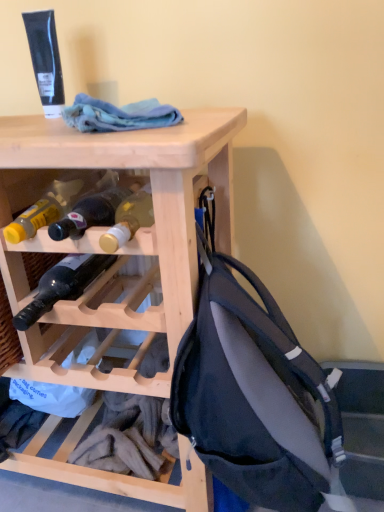
Question: Which direction should I rotate to look at matte glass bottle at center, acting as the second bottle starting from the bottom, — up or down?

Choices:
 (A) down
 (B) up

Answer: (B)

Question: Does matte black backpack at right have a larger size compared to matte glass bottle at center, acting as the second bottle starting from the bottom?

Choices:
 (A) yes
 (B) no

Answer: (A)

Question: Is matte black backpack at right at the right side of matte glass bottle at center, the 1th bottle viewed from the top?

Choices:
 (A) no
 (B) yes

Answer: (B)

Question: From a real-world perspective, is matte black backpack at right located higher than matte glass bottle at center, the 1th bottle viewed from the top?

Choices:
 (A) no
 (B) yes

Answer: (A)

Question: Can you confirm if matte black backpack at right is smaller than matte glass bottle at center, acting as the second bottle starting from the bottom?

Choices:
 (A) no
 (B) yes

Answer: (A)

Question: Is matte black backpack at right not inside matte glass bottle at center, acting as the second bottle starting from the bottom?

Choices:
 (A) no
 (B) yes

Answer: (B)

Question: From the image's perspective, is matte black backpack at right located above matte glass bottle at center, the 1th bottle viewed from the top?

Choices:
 (A) no
 (B) yes

Answer: (A)

Question: Is natural wood wine rack at upper center not near matte glass bottle at center, acting as the second bottle starting from the bottom?

Choices:
 (A) yes
 (B) no

Answer: (B)

Question: Could you tell me if natural wood wine rack at upper center is facing matte glass bottle at center, the 1th bottle viewed from the top?

Choices:
 (A) no
 (B) yes

Answer: (B)

Question: Is natural wood wine rack at upper center thinner than matte glass bottle at center, acting as the second bottle starting from the bottom?

Choices:
 (A) no
 (B) yes

Answer: (A)

Question: Is matte glass bottle at center, acting as the second bottle starting from the bottom, at the back of natural wood wine rack at upper center?

Choices:
 (A) no
 (B) yes

Answer: (A)

Question: Is natural wood wine rack at upper center to the right of matte glass bottle at center, the 1th bottle viewed from the top, from the viewer's perspective?

Choices:
 (A) no
 (B) yes

Answer: (A)

Question: From the image's perspective, is natural wood wine rack at upper center under matte glass bottle at center, the 1th bottle viewed from the top?

Choices:
 (A) no
 (B) yes

Answer: (B)

Question: Could you tell me if matte glass bottle at center, acting as the second bottle starting from the bottom, is facing blue cotton cloth at upper center?

Choices:
 (A) no
 (B) yes

Answer: (A)